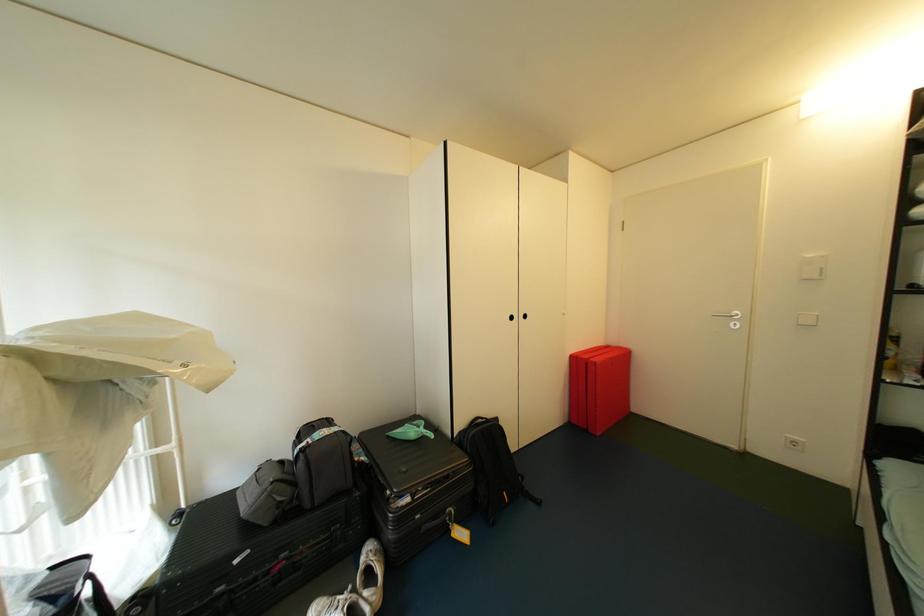
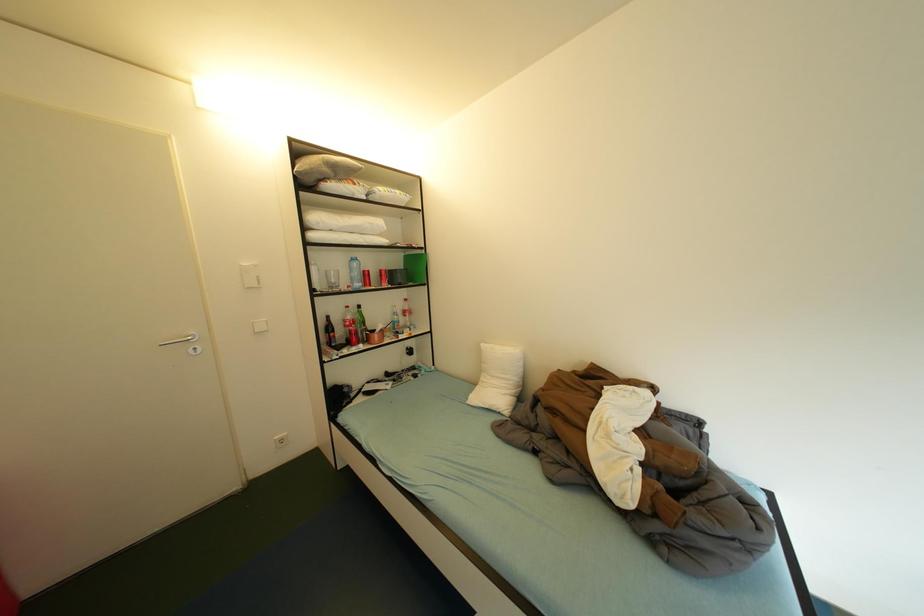
Question: The camera is either moving clockwise (left) or counter-clockwise (right) around the object. The first image is from the beginning of the video and the second image is from the end. Is the camera moving left or right when shooting the video?

Choices:
 (A) Left
 (B) Right

Answer: (A)